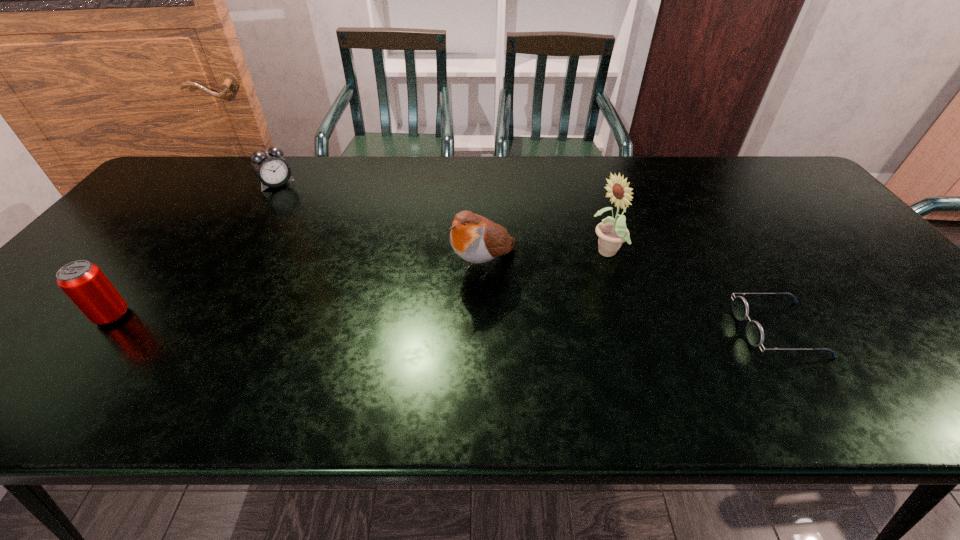
Find the location of a particular element. blank space at the far right corner of the desktop is located at coordinates (750, 166).

The height and width of the screenshot is (540, 960). I want to click on empty location between the can and the fourth object from right to left, so click(195, 250).

You are a GUI agent. You are given a task and a screenshot of the screen. Output one action in this format:
    pyautogui.click(x=<x>, y=<y>)
    Task: Click on the free space between the third tallest object and the farthest object
    The width and height of the screenshot is (960, 540).
    Given the screenshot: What is the action you would take?
    pyautogui.click(x=195, y=250)

This screenshot has height=540, width=960. In order to click on empty space between the second tallest object and the fourth tallest object in this screenshot , I will do `click(381, 224)`.

Where is `free space between the alarm clock and the leftmost object`? This screenshot has height=540, width=960. free space between the alarm clock and the leftmost object is located at coordinates (195, 250).

At what (x,y) coordinates should I click in order to perform the action: click on empty space that is in between the second tallest object and the sunflower. Please return your answer as a coordinate pair (x, y). Looking at the image, I should click on [546, 259].

At what (x,y) coordinates should I click in order to perform the action: click on free area in between the rightmost object and the bird. Please return your answer as a coordinate pair (x, y). Image resolution: width=960 pixels, height=540 pixels. Looking at the image, I should click on (632, 297).

Where is `empty space that is in between the second tallest object and the sunflower`? The height and width of the screenshot is (540, 960). empty space that is in between the second tallest object and the sunflower is located at coordinates (546, 259).

At what (x,y) coordinates should I click in order to perform the action: click on free area in between the tallest object and the shortest object. Please return your answer as a coordinate pair (x, y). The image size is (960, 540). Looking at the image, I should click on (692, 292).

Identify the location of empty location between the farthest object and the sunglasses. (527, 256).